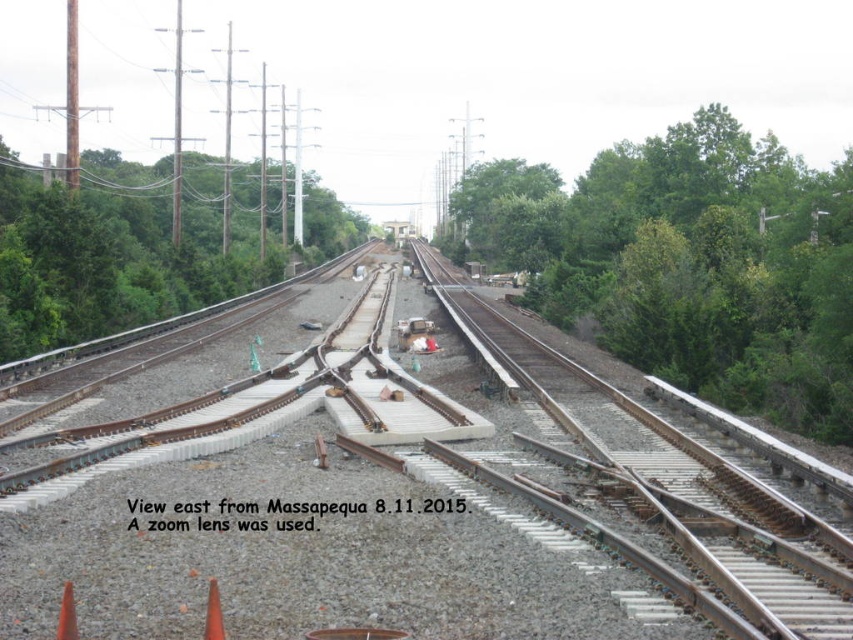
Who is taller, green leafy tree at left or orange plastic cone at lower left?

green leafy tree at left is taller.

Does point (134, 204) come in front of point (73, 637)?

No.

You are a GUI agent. You are given a task and a screenshot of the screen. Output one action in this format:
    pyautogui.click(x=<x>, y=<y>)
    Task: Click on the green leafy tree at left
    
    Given the screenshot: What is the action you would take?
    pyautogui.click(x=122, y=248)

Is rusty metal train track at center shorter than orange matte cone at lower left?

Incorrect, rusty metal train track at center's height does not fall short of orange matte cone at lower left's.

Locate an element on the screen. The width and height of the screenshot is (853, 640). rusty metal train track at center is located at coordinates (396, 493).

Can you confirm if green leafy tree at center is positioned above green leafy tree at left?

Correct, green leafy tree at center is located above green leafy tree at left.

Between green leafy tree at center and green leafy tree at left, which one has more height?

Standing taller between the two is green leafy tree at center.

Find the location of a particular element. This screenshot has width=853, height=640. green leafy tree at center is located at coordinates (688, 262).